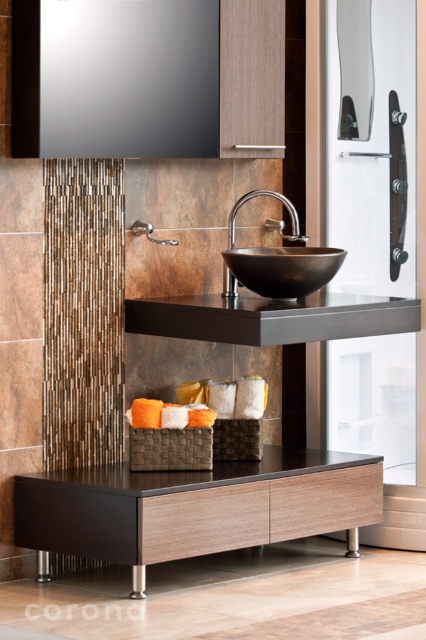
You are a home decorator planning to install a new light fixture above the vanity. The light fixture you chose is designed to hang 15 cm below the ceiling. Considering the height difference between the matte black vanity at center and the black polished bowl at center, which object should the light fixture be positioned closer to?

The matte black vanity at center is much taller than the black polished bowl at center, so the light fixture should be positioned closer to the black polished bowl at center to ensure it hangs at the correct height of 15 cm below the ceiling.

You are a bathroom designer checking the layout of the vanity area. You notice a point at coordinates (279, 269). What object is located at this point?

The point at coordinates (279, 269) has the black polished bowl at center located there.

You are designing a bathroom layout and need to place a new decorative item between the matte black vanity at center and the black polished bowl at center. Considering their sizes, which object should you place closer to the edge to ensure the decorative item fits comfortably?

Since the matte black vanity at center is wider than the black polished bowl at center, you should place the decorative item closer to the edge of the black polished bowl at center to ensure it fits comfortably between them.